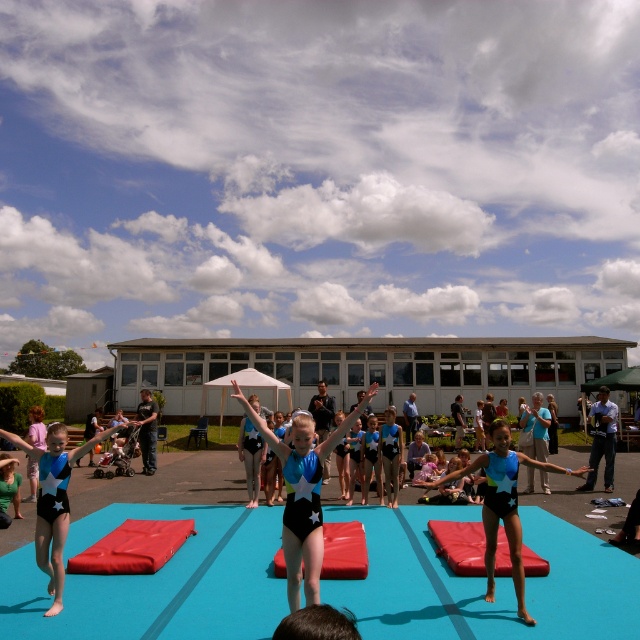
Question: Can you confirm if black leotard at left is positioned to the right of blue fabric jacket at lower right?

Choices:
 (A) no
 (B) yes

Answer: (A)

Question: Does blue spandex leotard at center appear on the right side of black leotard at left?

Choices:
 (A) no
 (B) yes

Answer: (B)

Question: Where is blue spandex leotard at center located in relation to black leotard at left in the image?

Choices:
 (A) right
 (B) left

Answer: (A)

Question: Which point is closer to the camera?

Choices:
 (A) (602, 422)
 (B) (314, 483)
 (C) (570, 472)
 (D) (83, 444)

Answer: (B)

Question: Which point is farther from the camera taking this photo?

Choices:
 (A) (310, 582)
 (B) (492, 468)
 (C) (61, 500)

Answer: (C)

Question: Which is nearer to the blue fabric jacket at lower right?

Choices:
 (A) shiny blue leotard at center
 (B) blue spandex leotard at center
 (C) black leotard at left

Answer: (B)